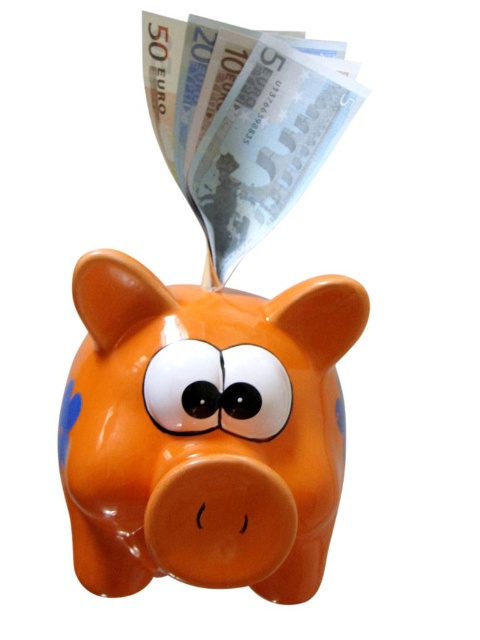
You are trying to place a decorative item on a narrow shelf that can only hold items up to the width of the glossy ceramic piggy bank at center. Can the silver metallic banknotes at upper center fit on the same shelf without exceeding the width limit?

The glossy ceramic piggy bank at center might be wider than silver metallic banknotes at upper center, so it is possible that the silver metallic banknotes at upper center can fit on the shelf since they are narrower than the piggy bank.

You are standing in front of the glossy ceramic piggy bank at center. If you move 0.1 units to the right and 0.05 units up from your current position, will you be closer to the piggy bank?

The glossy ceramic piggy bank at center is located at point (204,429). Moving 0.1 units to the right and 0.05 units up would place you at a new position. Since the piggy bank is at the center, moving away from its coordinates would mean you are moving further away. Therefore, you will be farther from the piggy bank.

You are standing 3 feet away from the glossy ceramic piggy bank at center. Can you reach it without moving your feet?

The glossy ceramic piggy bank at center is 35.37 inches away from the viewer. Since 3 feet equals 36 inches, you are slightly closer than the stated distance, so you can reach it without moving your feet.